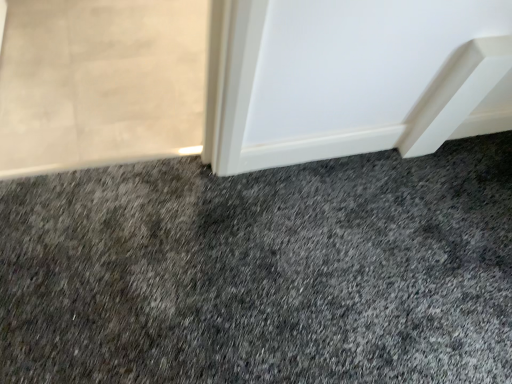
Question: Considering the relative positions of translucent glass screen door at upper left and dark gray carpet at center in the image provided, is translucent glass screen door at upper left to the left or to the right of dark gray carpet at center?

Choices:
 (A) right
 (B) left

Answer: (B)

Question: From the image's perspective, is translucent glass screen door at upper left above or below dark gray carpet at center?

Choices:
 (A) below
 (B) above

Answer: (B)

Question: Does point (62, 69) appear closer or farther from the camera than point (52, 337)?

Choices:
 (A) farther
 (B) closer

Answer: (A)

Question: Is dark gray carpet at center inside or outside of translucent glass screen door at upper left?

Choices:
 (A) inside
 (B) outside

Answer: (B)

Question: Considering the relative positions of dark gray carpet at center and translucent glass screen door at upper left in the image provided, is dark gray carpet at center to the left or to the right of translucent glass screen door at upper left?

Choices:
 (A) right
 (B) left

Answer: (A)

Question: Considering the positions of dark gray carpet at center and translucent glass screen door at upper left in the image, is dark gray carpet at center wider or thinner than translucent glass screen door at upper left?

Choices:
 (A) wide
 (B) thin

Answer: (A)

Question: In the image, is dark gray carpet at center positioned in front of or behind translucent glass screen door at upper left?

Choices:
 (A) front
 (B) behind

Answer: (A)